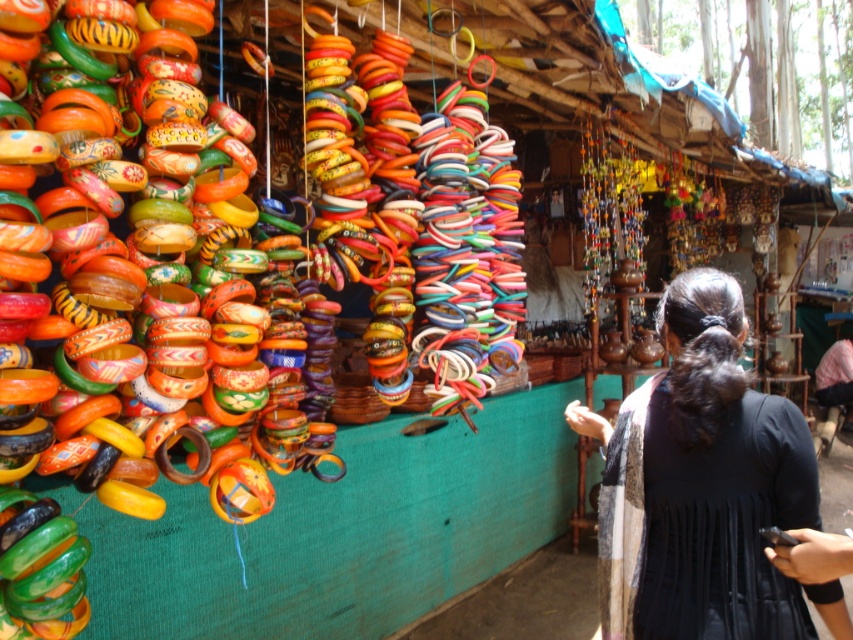
Question: Is black fabric at center bigger than matte orange bangle at center?

Choices:
 (A) no
 (B) yes

Answer: (B)

Question: Observing the image, what is the correct spatial positioning of black fabric at center in reference to matte orange bangle at center?

Choices:
 (A) right
 (B) left

Answer: (B)

Question: Which point is closer to the camera?

Choices:
 (A) matte orange bangle at center
 (B) black fabric at center

Answer: (A)

Question: Where is black fabric at center located in relation to matte orange bangle at center in the image?

Choices:
 (A) above
 (B) below

Answer: (A)

Question: Which of the following is the closest to the observer?

Choices:
 (A) black fabric at center
 (B) matte orange bangle at center

Answer: (B)